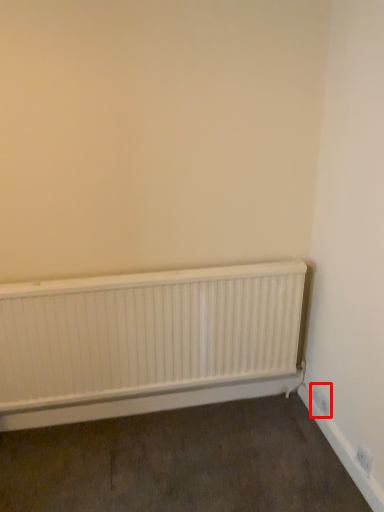
Question: From the image's perspective, what is the correct spatial positioning of electric outlet (annotated by the red box) in reference to radiator?

Choices:
 (A) below
 (B) above

Answer: (A)